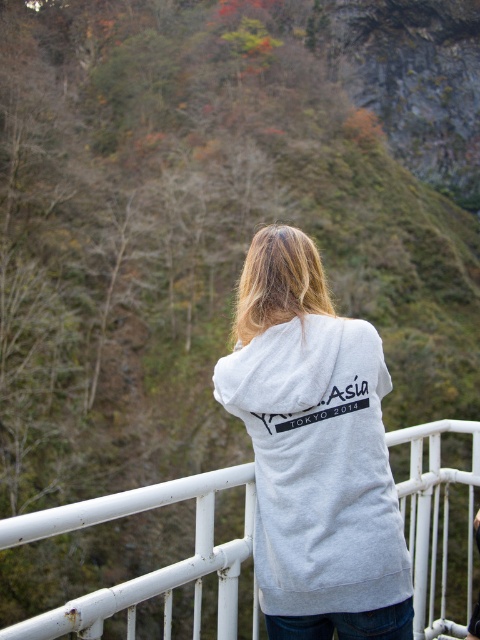
Between gray cotton hoodie at center and white metal railing at center, which one appears on the left side from the viewer's perspective?

Positioned to the left is white metal railing at center.

Who is taller, gray cotton hoodie at center or white metal railing at center?

white metal railing at center

Find the location of `gray cotton hoodie at center`. gray cotton hoodie at center is located at coordinates (314, 451).

Where is `gray cotton hoodie at center`? The image size is (480, 640). gray cotton hoodie at center is located at coordinates (314, 451).